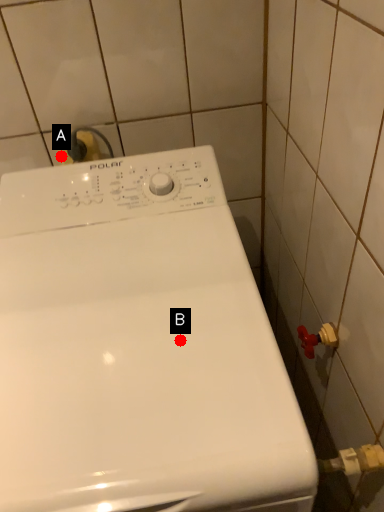
Question: Two points are circled on the image, labeled by A and B beside each circle. Which point is farther to the camera?

Choices:
 (A) A is further
 (B) B is further

Answer: (A)